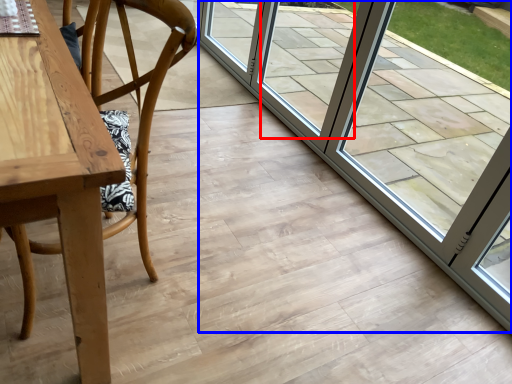
Question: Which of the following is the closest to the observer, window (highlighted by a red box) or door (highlighted by a blue box)?

Choices:
 (A) window
 (B) door

Answer: (B)